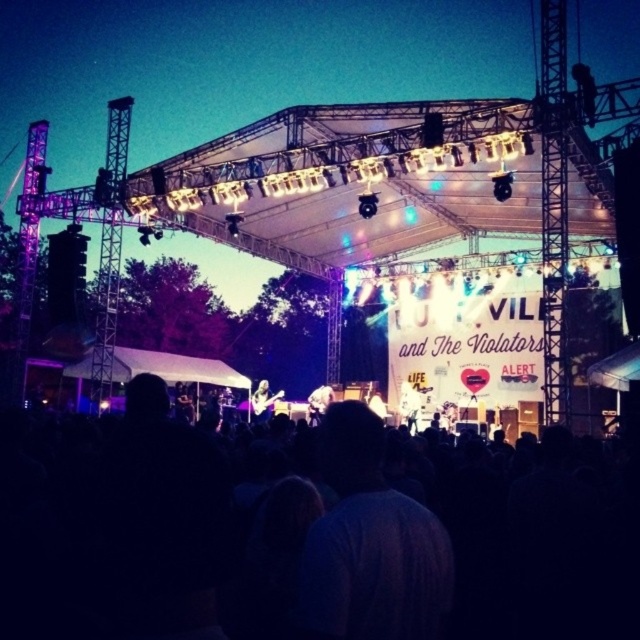
Question: Is black fabric crowd at center to the right of shiny black guitar at center from the viewer's perspective?

Choices:
 (A) no
 (B) yes

Answer: (A)

Question: Which of the following is the closest to the observer?

Choices:
 (A) shiny black guitar at center
 (B) glossy black guitar at center
 (C) white fabric at center
 (D) black fabric crowd at center

Answer: (D)

Question: Which object is the closest to the glossy black guitar at center?

Choices:
 (A) black fabric crowd at center
 (B) white fabric at center

Answer: (B)

Question: Does black fabric crowd at center lie behind glossy black guitar at center?

Choices:
 (A) no
 (B) yes

Answer: (A)

Question: Which object is the closest to the glossy black guitar at center?

Choices:
 (A) black fabric crowd at center
 (B) white fabric at center

Answer: (B)

Question: Where is black fabric crowd at center located in relation to white fabric at center in the image?

Choices:
 (A) below
 (B) above

Answer: (A)